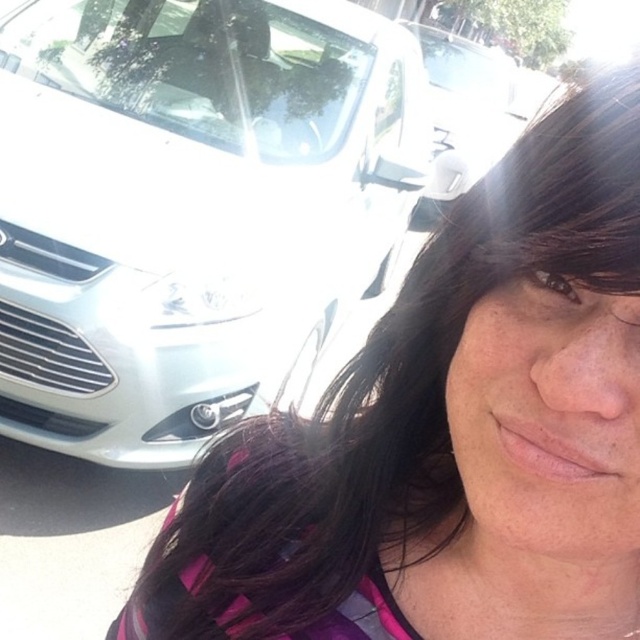
Which of these two, white glossy car at left or white glossy car at upper left, stands taller?

With more height is white glossy car at upper left.

Which is behind, point (310, 100) or point (433, 70)?

The point (433, 70) is more distant.

This screenshot has height=640, width=640. What do you see at coordinates (189, 208) in the screenshot? I see `white glossy car at left` at bounding box center [189, 208].

Find the location of a particular element. Image resolution: width=640 pixels, height=640 pixels. white glossy car at left is located at coordinates (189, 208).